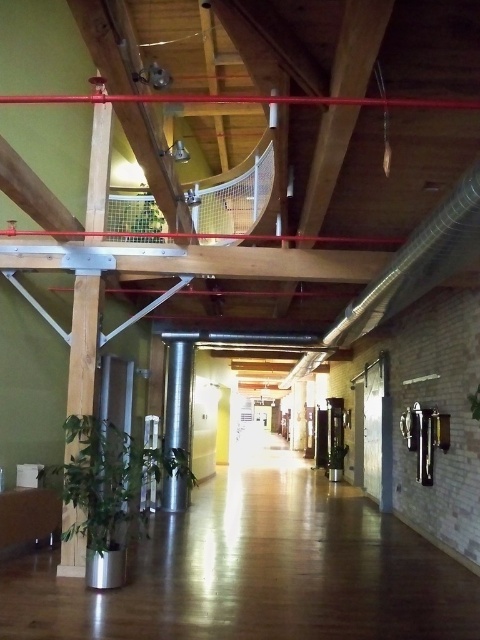
Question: Among these points, which one is nearest to the camera?

Choices:
 (A) (154, 93)
 (B) (132, 516)

Answer: (A)

Question: Does metallic red railing at upper center have a smaller size compared to green leafy plant at upper center?

Choices:
 (A) no
 (B) yes

Answer: (B)

Question: Which object appears farthest from the camera in this image?

Choices:
 (A) green leafy plant at lower left
 (B) silver metallic pillar at center

Answer: (B)

Question: Can you confirm if green leafy plant at lower left is positioned to the left of silver metallic pillar at center?

Choices:
 (A) no
 (B) yes

Answer: (B)

Question: Estimate the real-world distances between objects in this image. Which object is closer to the silver metallic pillar at center?

Choices:
 (A) metallic red railing at upper center
 (B) green leafy plant at lower left
 (C) green leafy plant at upper center

Answer: (B)

Question: Is green leafy plant at lower left thinner than green leafy plant at upper center?

Choices:
 (A) yes
 (B) no

Answer: (B)